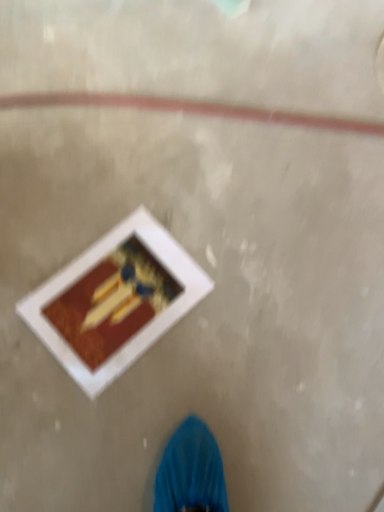
Find the location of a particular element. white matte picture frame at center is located at coordinates (115, 300).

What do you see at coordinates (115, 300) in the screenshot? I see `white matte picture frame at center` at bounding box center [115, 300].

What are the coordinates of `white matte picture frame at center` in the screenshot? It's located at (115, 300).